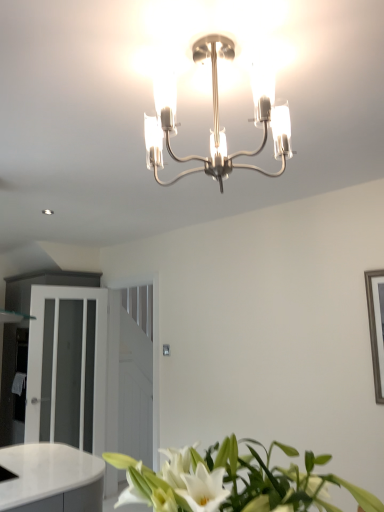
Question: Is white glossy leaves at lower center aimed at white glossy dresser at left?

Choices:
 (A) yes
 (B) no

Answer: (A)

Question: From the image's perspective, is white glossy leaves at lower center located beneath white glossy dresser at left?

Choices:
 (A) yes
 (B) no

Answer: (B)

Question: From a real-world perspective, is white glossy leaves at lower center on white glossy dresser at left?

Choices:
 (A) yes
 (B) no

Answer: (B)

Question: Is white glossy dresser at left inside white glossy leaves at lower center?

Choices:
 (A) yes
 (B) no

Answer: (B)

Question: Is white glossy leaves at lower center outside white glossy dresser at left?

Choices:
 (A) no
 (B) yes

Answer: (B)

Question: Can you confirm if white glossy leaves at lower center is bigger than white glossy dresser at left?

Choices:
 (A) yes
 (B) no

Answer: (B)

Question: Considering the relative sizes of white glossy leaves at lower center and white frosted glass door at left in the image provided, is white glossy leaves at lower center bigger than white frosted glass door at left?

Choices:
 (A) yes
 (B) no

Answer: (B)

Question: Is white glossy leaves at lower center completely or partially outside of white frosted glass door at left?

Choices:
 (A) no
 (B) yes

Answer: (B)

Question: Is white glossy leaves at lower center positioned with its back to white frosted glass door at left?

Choices:
 (A) no
 (B) yes

Answer: (A)

Question: From the image's perspective, is white glossy leaves at lower center beneath white frosted glass door at left?

Choices:
 (A) yes
 (B) no

Answer: (B)

Question: Is white glossy leaves at lower center shorter than white frosted glass door at left?

Choices:
 (A) no
 (B) yes

Answer: (B)

Question: Does white glossy leaves at lower center appear on the right side of white frosted glass door at left?

Choices:
 (A) no
 (B) yes

Answer: (B)

Question: Would you say white glossy leaves at lower center is a long distance from polished chrome chandelier at center?

Choices:
 (A) yes
 (B) no

Answer: (B)